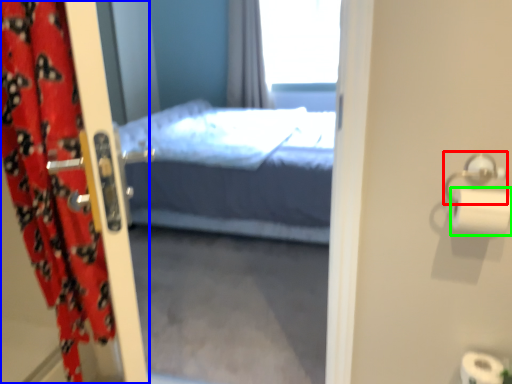
Question: Considering the real-world distances, which object is farthest from towel bar (highlighted by a red box)? curtain (highlighted by a blue box) or toilet paper (highlighted by a green box)?

Choices:
 (A) curtain
 (B) toilet paper

Answer: (A)